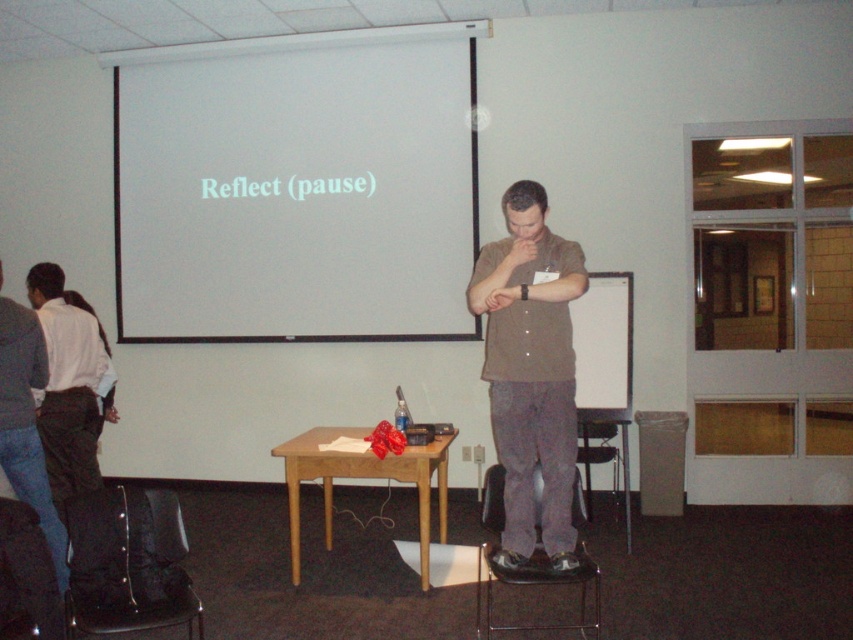
Question: Which object appears farthest from the camera in this image?

Choices:
 (A) white matte projection screen at upper center
 (B) brown wooden table at center
 (C) brown cotton shirt at center

Answer: (A)

Question: Which object is the closest to the brown wooden table at center?

Choices:
 (A) white matte projection screen at upper center
 (B) brown cotton shirt at center

Answer: (B)

Question: Can you confirm if brown cotton shirt at center is thinner than brown wooden table at center?

Choices:
 (A) no
 (B) yes

Answer: (B)

Question: Is white matte projection screen at upper center below brown wooden table at center?

Choices:
 (A) yes
 (B) no

Answer: (B)

Question: Based on their relative distances, which object is farther from the brown wooden table at center?

Choices:
 (A) brown cotton shirt at center
 (B) white matte projection screen at upper center

Answer: (B)

Question: Where is white matte projection screen at upper center located in relation to brown cotton shirt at center in the image?

Choices:
 (A) below
 (B) above

Answer: (B)